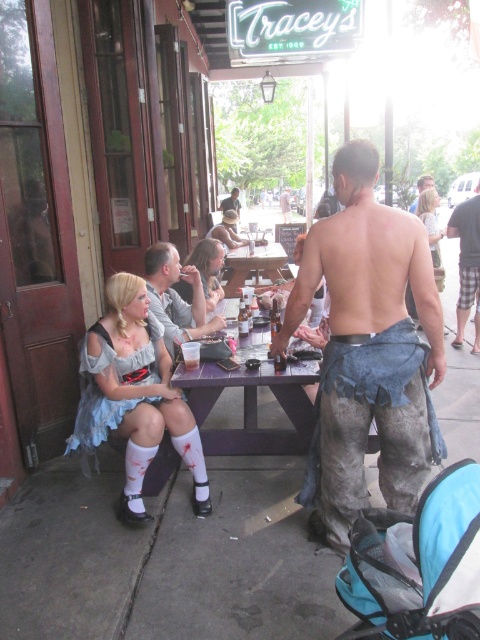
Question: Is matte gray shirt at center positioned at the back of wooden picnic table at center?

Choices:
 (A) no
 (B) yes

Answer: (A)

Question: Among these objects, which one is nearest to the camera?

Choices:
 (A) denim shorts at center
 (B) wooden picnic table at center
 (C) matte gray shirt at center
 (D) smooth leather jacket at center

Answer: (C)

Question: Among these objects, which one is farthest from the camera?

Choices:
 (A) dirty denim shorts at center
 (B) plaid shorts at right
 (C) smooth leather jacket at center
 (D) purple wood table at center

Answer: (C)

Question: Can you confirm if purple wood table at center is bigger than matte gray shirt at center?

Choices:
 (A) yes
 (B) no

Answer: (A)

Question: Among these points, which one is nearest to the camera?

Choices:
 (A) (459, 333)
 (B) (225, 200)
 (C) (322, 236)
 (D) (284, 208)

Answer: (C)

Question: Is matte gray shirt at center thinner than wooden picnic table at center?

Choices:
 (A) yes
 (B) no

Answer: (A)